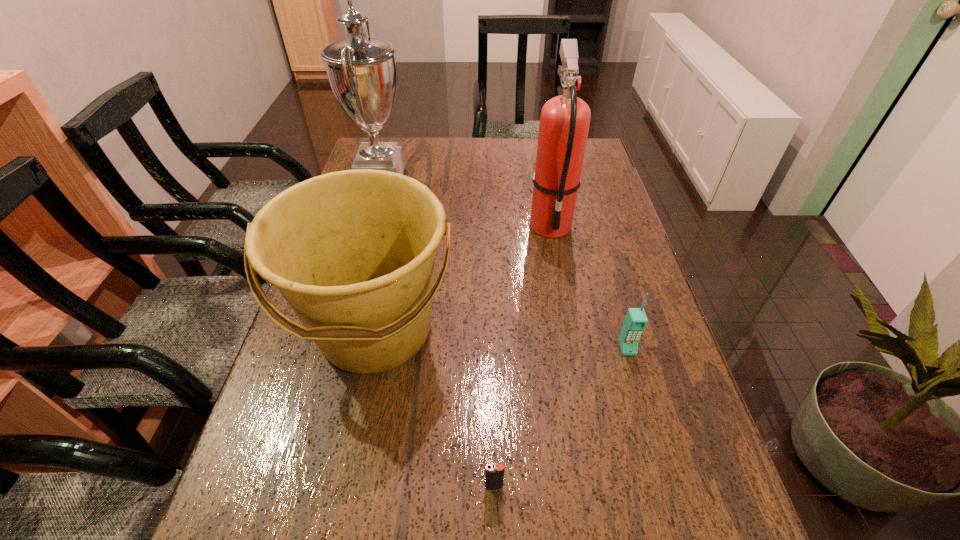
The height and width of the screenshot is (540, 960). I want to click on object identified as the third closest to the trophy cup, so click(x=636, y=320).

I want to click on vacant point that satisfies the following two spatial constraints: 1. on the side of the third tallest object with the handle; 2. on the left side of the igniter, so click(344, 487).

You are a GUI agent. You are given a task and a screenshot of the screen. Output one action in this format:
    pyautogui.click(x=<x>, y=<y>)
    Task: Click on the blank area in the image that satisfies the following two spatial constraints: 1. at the front view of the trophy cup; 2. on the left side of the third object from left to right
    This screenshot has height=540, width=960.
    Given the screenshot: What is the action you would take?
    pyautogui.click(x=303, y=487)